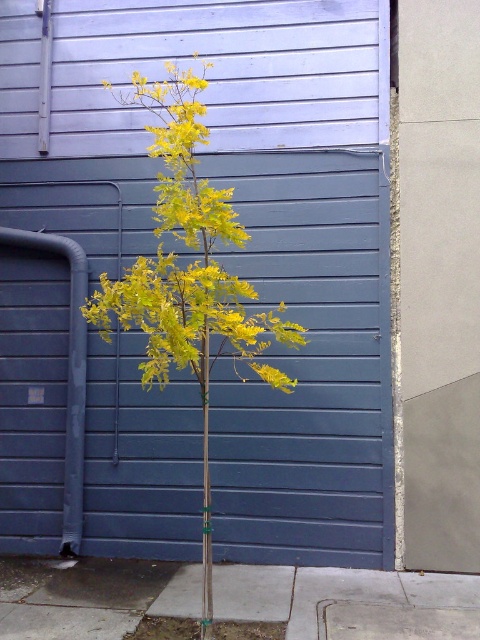
You are standing at the origin point of the coordinate system. You want to walk to the gray concrete pavement at center. Which direction should you go?

The gray concrete pavement at center is located at coordinate point (349, 602), so you should move towards the northeast direction from your current position at the origin.